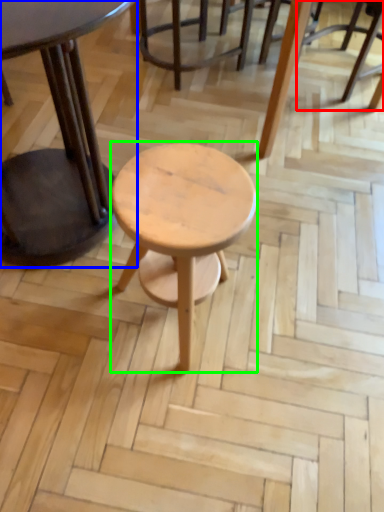
Question: Estimate the real-world distances between objects in this image. Which object is farther from chair (highlighted by a red box), table (highlighted by a blue box) or stool (highlighted by a green box)?

Choices:
 (A) table
 (B) stool

Answer: (B)